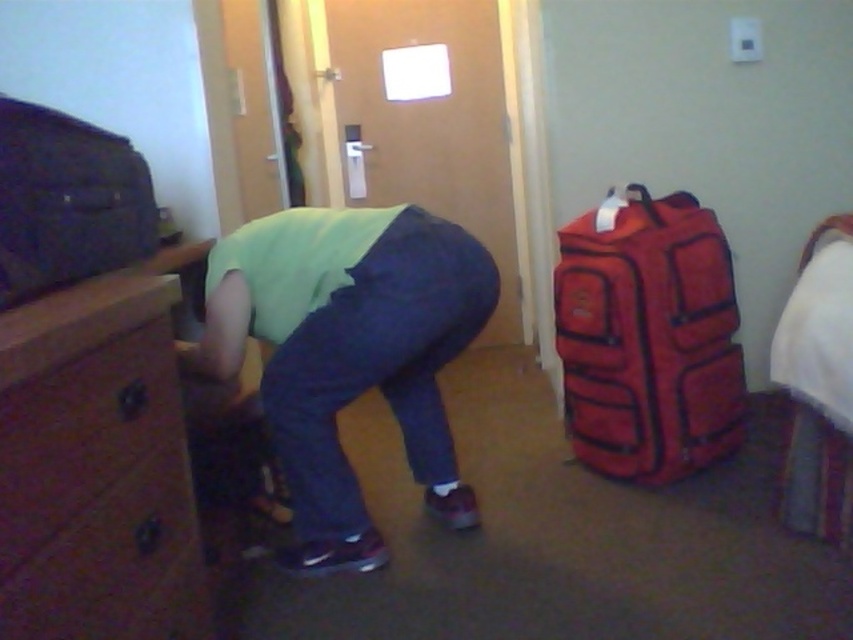
Who is higher up, green matte shirt at center or red fabric suitcase at right?

Positioned higher is red fabric suitcase at right.

Describe the element at coordinates (347, 353) in the screenshot. This screenshot has width=853, height=640. I see `green matte shirt at center` at that location.

Between point (341, 556) and point (581, 333), which one is positioned in front?

Point (341, 556)

The height and width of the screenshot is (640, 853). What are the coordinates of `green matte shirt at center` in the screenshot? It's located at (347, 353).

Can you confirm if brown wood dresser at left is bigger than green matte shirt at center?

Incorrect, brown wood dresser at left is not larger than green matte shirt at center.

Is the position of brown wood dresser at left more distant than that of green matte shirt at center?

No, it is in front of green matte shirt at center.

Image resolution: width=853 pixels, height=640 pixels. What do you see at coordinates (97, 465) in the screenshot?
I see `brown wood dresser at left` at bounding box center [97, 465].

I want to click on brown wood dresser at left, so click(x=97, y=465).

Between brown wood dresser at left and red fabric suitcase at right, which one appears on the right side from the viewer's perspective?

red fabric suitcase at right

Does point (114, 294) lie in front of point (668, 376)?

Yes, point (114, 294) is closer to viewer.

The width and height of the screenshot is (853, 640). Identify the location of brown wood dresser at left. (97, 465).